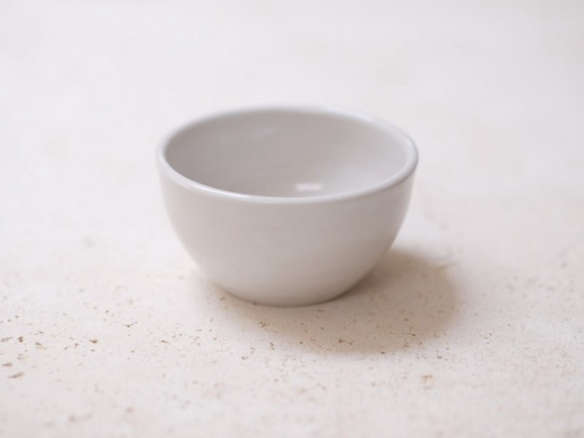
At what (x,y) coordinates should I click in order to perform the action: click on the bottom of cup. Please return your answer as a coordinate pair (x, y). The height and width of the screenshot is (438, 584). Looking at the image, I should click on (296, 300).